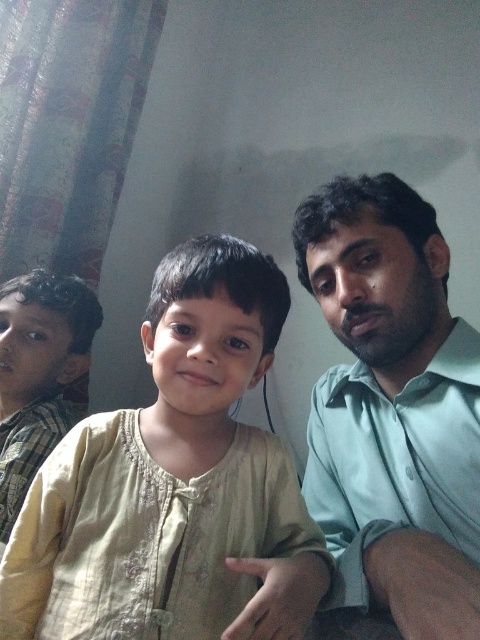
You are a photographer trying to capture a group photo. You notice the green matte shirt at right and the light brown plaid shirt at left in your frame. Which shirt should you adjust to ensure both are fully visible in the photo?

The green matte shirt at right is located above the light brown plaid shirt at left, so you should adjust the green matte shirt at right downward to make space for the light brown plaid shirt at left and ensure both are fully visible.

You are an interior designer assessing the color coordination in the scene. The light beige fabric at center and the green matte shirt at right are both visible in the image. Which of these two items has a smaller size?

The light beige fabric at center has a smaller size compared to the green matte shirt at right.

You are standing in the room and want to place a small gift box at point [279,550]. The gift box requires a space that is at least 20 inches away from the camera to avoid being stepped on. Will this point be safe?

The distance of point [279,550] from the camera is 24.62 inches, which is more than the required 20 inches. Therefore, placing the gift box there will be safe.